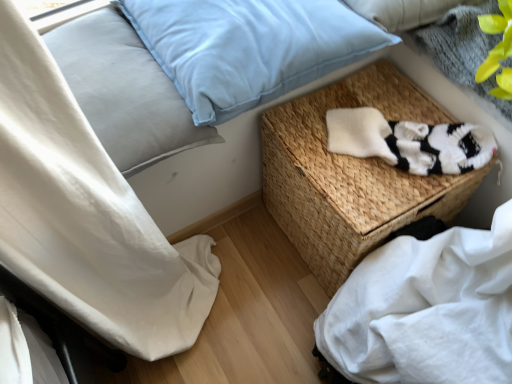
Question: Considering the positions of white knitted socks at center-right and light blue fabric pillow at upper left, which is the 2th pillow from right to left, in the image, is white knitted socks at center-right wider or thinner than light blue fabric pillow at upper left, which is the 2th pillow from right to left,?

Choices:
 (A) thin
 (B) wide

Answer: (A)

Question: Considering their positions, is white knitted socks at center-right located in front of or behind light blue fabric pillow at upper left, which is the 2th pillow from right to left?

Choices:
 (A) behind
 (B) front

Answer: (A)

Question: Which object is positioned closest to the light blue fabric pillow at upper left, which is the first pillow in left-to-right order?

Choices:
 (A) woven wicker basket at center
 (B) light blue velvety pillow at upper center, the first pillow in the right-to-left sequence
 (C) white cotton sheet at lower right
 (D) white knitted socks at center-right

Answer: (B)

Question: Considering the real-world distances, which object is closest to the white cotton sheet at lower right?

Choices:
 (A) woven wicker basket at center
 (B) light blue fabric pillow at upper left, which is the 2th pillow from right to left
 (C) white knitted socks at center-right
 (D) light blue velvety pillow at upper center, the first pillow in the right-to-left sequence

Answer: (A)